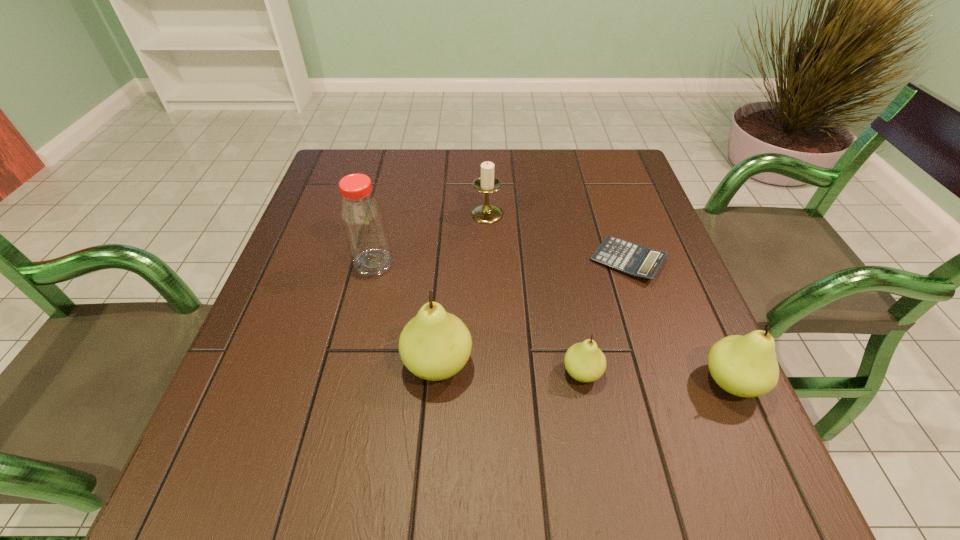
All pears are currently evenly spaced. To continue this pattern, where would you add another pear on the left? Please point out a vacant spot. Please provide its 2D coordinates. Your answer should be formatted as a tuple, i.e. [(x, y)], where the tuple contains the x and y coordinates of a point satisfying the conditions above.

[(299, 355)]